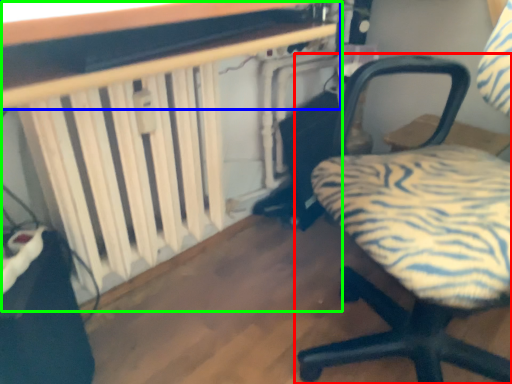
Question: Considering the real-world distances, which object is farthest from chair (highlighted by a red box)? table (highlighted by a blue box) or table (highlighted by a green box)?

Choices:
 (A) table
 (B) table

Answer: (A)